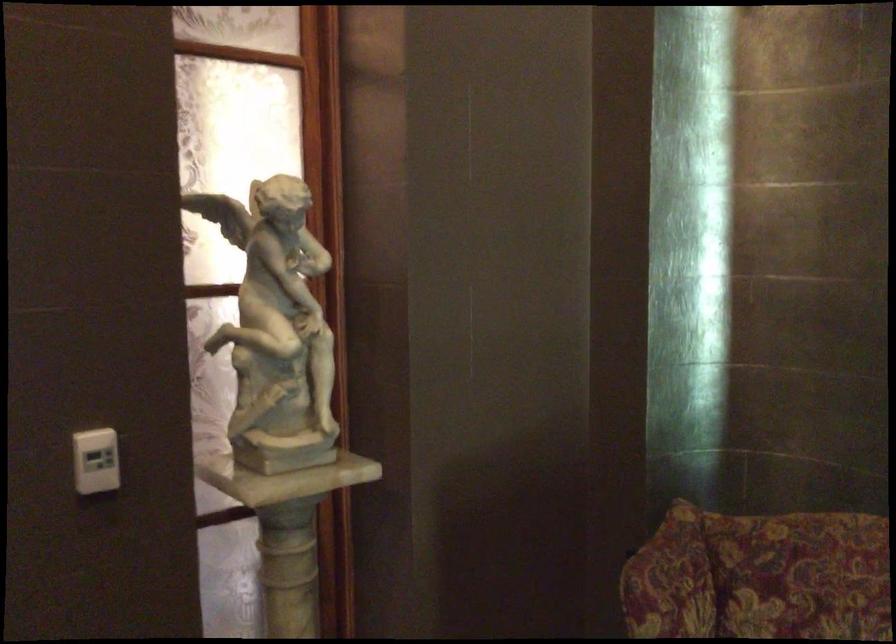
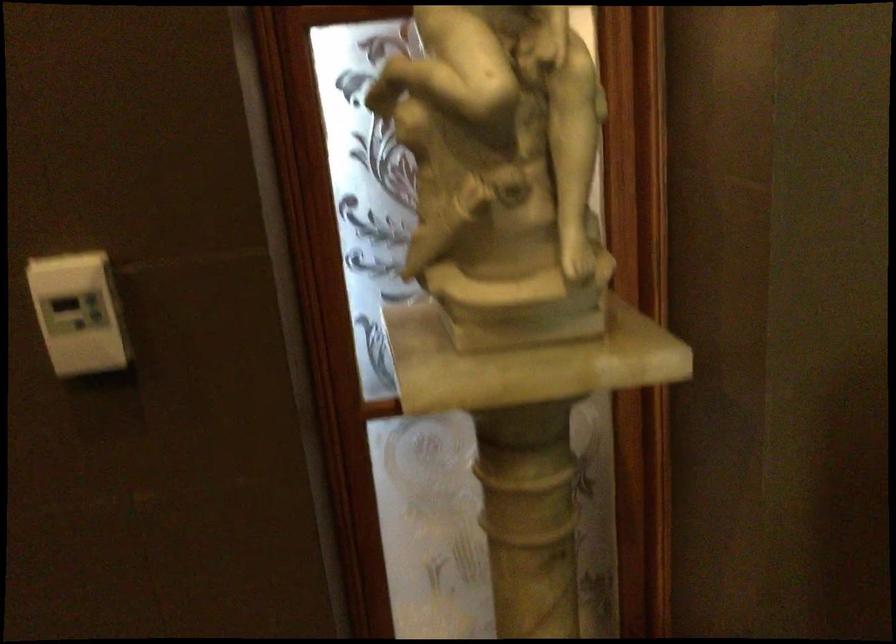
The point at (286,384) is marked in the first image. Where is the corresponding point in the second image?

(502, 172)